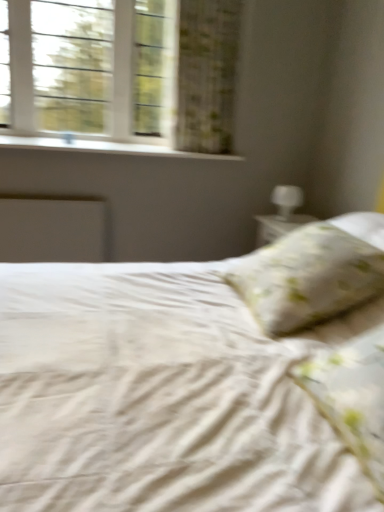
Question: Is white glass window at upper left thinner than fluffy white pillow at right, which is the second pillow in back-to-front order?

Choices:
 (A) no
 (B) yes

Answer: (B)

Question: Can we say white glass window at upper left lies outside fluffy white pillow at right, which is the second pillow in back-to-front order?

Choices:
 (A) no
 (B) yes

Answer: (B)

Question: Does white glass window at upper left have a smaller size compared to fluffy white pillow at right, which is the second pillow in back-to-front order?

Choices:
 (A) no
 (B) yes

Answer: (A)

Question: Is the depth of white glass window at upper left less than that of fluffy white pillow at right, placed as the 1th pillow when sorted from front to back?

Choices:
 (A) yes
 (B) no

Answer: (B)

Question: From a real-world perspective, is white glass window at upper left positioned under fluffy white pillow at right, which is the second pillow in back-to-front order, based on gravity?

Choices:
 (A) no
 (B) yes

Answer: (A)

Question: From the image's perspective, does white glass window at upper left appear lower than fluffy white pillow at right, which is the second pillow in back-to-front order?

Choices:
 (A) yes
 (B) no

Answer: (B)

Question: Is the depth of white floral pillow at center, which ranks as the second pillow in front-to-back order, greater than that of green floral fabric curtain at upper left?

Choices:
 (A) no
 (B) yes

Answer: (A)

Question: Does white floral pillow at center, which ranks as the second pillow in front-to-back order, lie in front of green floral fabric curtain at upper left?

Choices:
 (A) yes
 (B) no

Answer: (A)

Question: From a real-world perspective, is white floral pillow at center, the first pillow viewed from the back, located beneath green floral fabric curtain at upper left?

Choices:
 (A) yes
 (B) no

Answer: (A)

Question: Does white floral pillow at center, the first pillow viewed from the back, have a smaller size compared to green floral fabric curtain at upper left?

Choices:
 (A) no
 (B) yes

Answer: (B)

Question: Is green floral fabric curtain at upper left surrounded by white floral pillow at center, which ranks as the second pillow in front-to-back order?

Choices:
 (A) yes
 (B) no

Answer: (B)

Question: Considering the relative sizes of white floral pillow at center, which ranks as the second pillow in front-to-back order, and green floral fabric curtain at upper left in the image provided, is white floral pillow at center, which ranks as the second pillow in front-to-back order, shorter than green floral fabric curtain at upper left?

Choices:
 (A) no
 (B) yes

Answer: (B)

Question: From a real-world perspective, is green floral fabric curtain at upper left positioned under fluffy white pillow at right, which is the second pillow in back-to-front order, based on gravity?

Choices:
 (A) yes
 (B) no

Answer: (B)